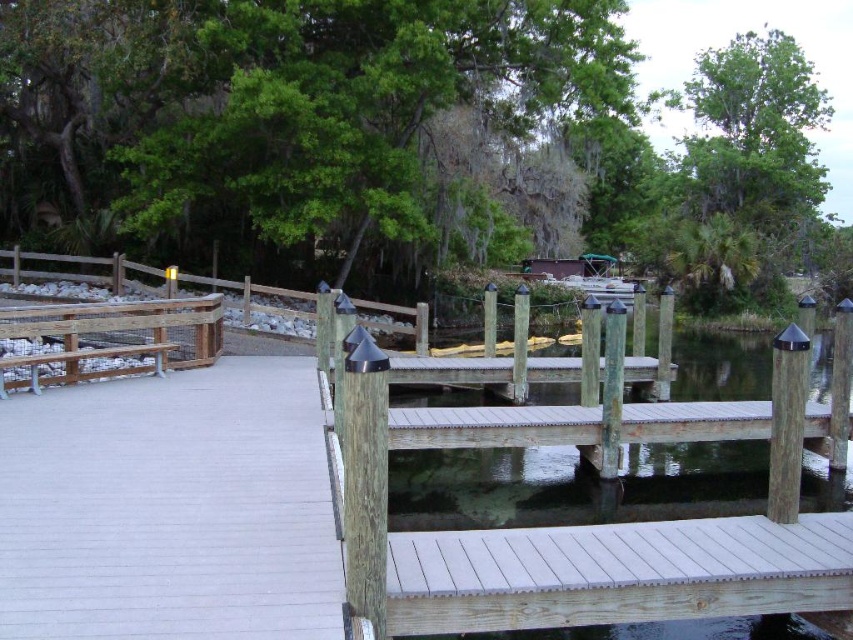
Question: Observing the image, what is the correct spatial positioning of white wood dock at center in reference to wooden bench at left?

Choices:
 (A) below
 (B) above

Answer: (A)

Question: Which point is closer to the camera taking this photo?

Choices:
 (A) (117, 321)
 (B) (717, 531)

Answer: (B)

Question: Considering the relative positions of white wood dock at center and wooden bench at left in the image provided, where is white wood dock at center located with respect to wooden bench at left?

Choices:
 (A) right
 (B) left

Answer: (A)

Question: Does white wood dock at center have a greater width compared to wooden bench at left?

Choices:
 (A) no
 (B) yes

Answer: (B)

Question: Which point is closer to the camera?

Choices:
 (A) white wood dock at center
 (B) wooden bench at left

Answer: (A)